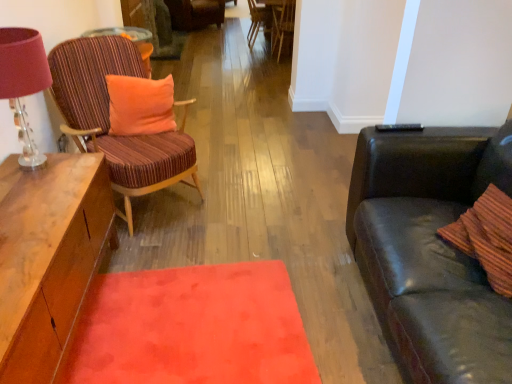
Question: Should I look upward or downward to see velvet striped chair at center, the fourth chair positioned from the bottom?

Choices:
 (A) down
 (B) up

Answer: (B)

Question: Does velvet striped chair at center, the fourth chair positioned from the bottom, contain striped fabric chair at left, the 4th chair when ordered from top to bottom?

Choices:
 (A) no
 (B) yes

Answer: (A)

Question: Does velvet striped chair at center, the fourth chair positioned from the bottom, have a smaller size compared to striped fabric chair at left, the 1th chair in the bottom-to-top sequence?

Choices:
 (A) yes
 (B) no

Answer: (A)

Question: Does velvet striped chair at center, acting as the 1th chair starting from the back, have a larger size compared to striped fabric chair at left, the 4th chair when ordered from top to bottom?

Choices:
 (A) no
 (B) yes

Answer: (A)

Question: Is velvet striped chair at center, acting as the 1th chair starting from the back, positioned before striped fabric chair at left, the 1th chair in the bottom-to-top sequence?

Choices:
 (A) yes
 (B) no

Answer: (B)

Question: Would you consider velvet striped chair at center, acting as the 1th chair starting from the back, to be distant from striped fabric chair at left, the 4th chair when ordered from top to bottom?

Choices:
 (A) yes
 (B) no

Answer: (A)

Question: Is velvet striped chair at center, the fourth chair positioned from the bottom, facing towards striped fabric chair at left, the 4th chair when ordered from back to front?

Choices:
 (A) no
 (B) yes

Answer: (A)

Question: From a real-world perspective, is wooden chair at center, the 2th chair from the bottom, located beneath velvet striped chair at center, placed as the fourth chair when sorted from front to back?

Choices:
 (A) yes
 (B) no

Answer: (B)

Question: Is wooden chair at center, arranged as the 2th chair when viewed from the front, located outside velvet striped chair at center, the fourth chair positioned from the bottom?

Choices:
 (A) yes
 (B) no

Answer: (A)

Question: Can you confirm if wooden chair at center, the 3th chair from the back, is bigger than velvet striped chair at center, placed as the fourth chair when sorted from front to back?

Choices:
 (A) yes
 (B) no

Answer: (B)

Question: From the image's perspective, is wooden chair at center, the 2th chair from the bottom, located above velvet striped chair at center, placed as the fourth chair when sorted from front to back?

Choices:
 (A) no
 (B) yes

Answer: (A)

Question: Considering the relative positions of wooden chair at center, which ranks as the third chair in top-to-bottom order, and velvet striped chair at center, the fourth chair positioned from the bottom, in the image provided, is wooden chair at center, which ranks as the third chair in top-to-bottom order, to the right of velvet striped chair at center, the fourth chair positioned from the bottom, from the viewer's perspective?

Choices:
 (A) yes
 (B) no

Answer: (A)

Question: Is wooden chair at center, the 3th chair from the back, wider than velvet striped chair at center, the fourth chair positioned from the bottom?

Choices:
 (A) yes
 (B) no

Answer: (B)

Question: Does striped fabric chair at left, the 1th chair in the bottom-to-top sequence, have a smaller size compared to matte wood desk at upper left?

Choices:
 (A) yes
 (B) no

Answer: (B)